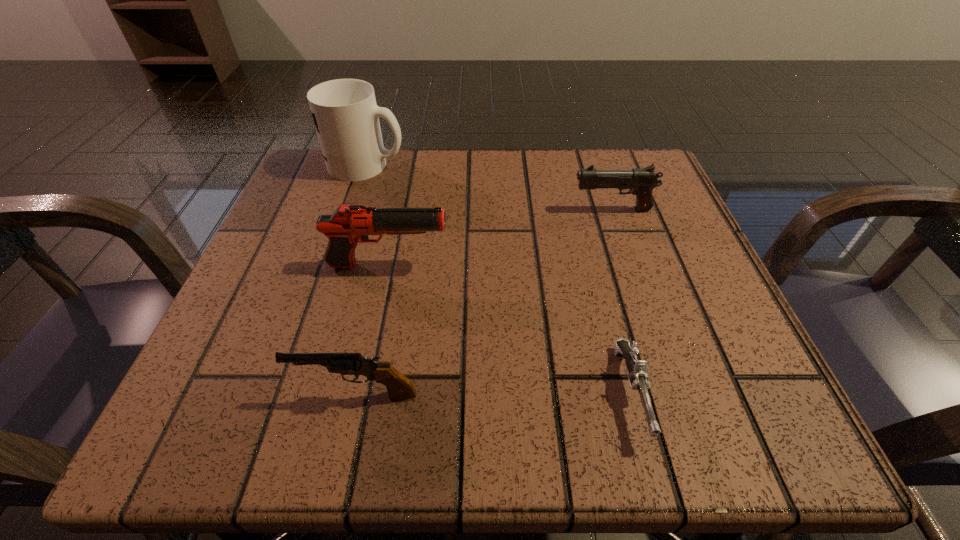
In the image, there is a desktop. Find the location of `vacant space at the left edge`. vacant space at the left edge is located at coordinates (270, 333).

The width and height of the screenshot is (960, 540). What are the coordinates of `vacant area at the right edge of the desktop` in the screenshot? It's located at (711, 294).

Locate an element on the screen. Image resolution: width=960 pixels, height=540 pixels. free spot at the far left corner of the desktop is located at coordinates (324, 189).

What are the coordinates of `free region at the near right corner` in the screenshot? It's located at (737, 408).

Where is `empty space between the second farthest gun and the shortest object`? The width and height of the screenshot is (960, 540). empty space between the second farthest gun and the shortest object is located at coordinates (510, 329).

Locate an element on the screen. Image resolution: width=960 pixels, height=540 pixels. vacant space in between the tallest object and the farthest gun is located at coordinates (490, 187).

Identify the location of free space between the fourth nearest object and the shortest object. (622, 301).

Where is `free spot between the shortest gun and the fourth shortest object`? free spot between the shortest gun and the fourth shortest object is located at coordinates (510, 329).

Where is `empty location between the second farthest gun and the farthest gun`? This screenshot has height=540, width=960. empty location between the second farthest gun and the farthest gun is located at coordinates (500, 238).

In order to click on object that is the second closest to the second farthest object in this screenshot , I will do `click(637, 369)`.